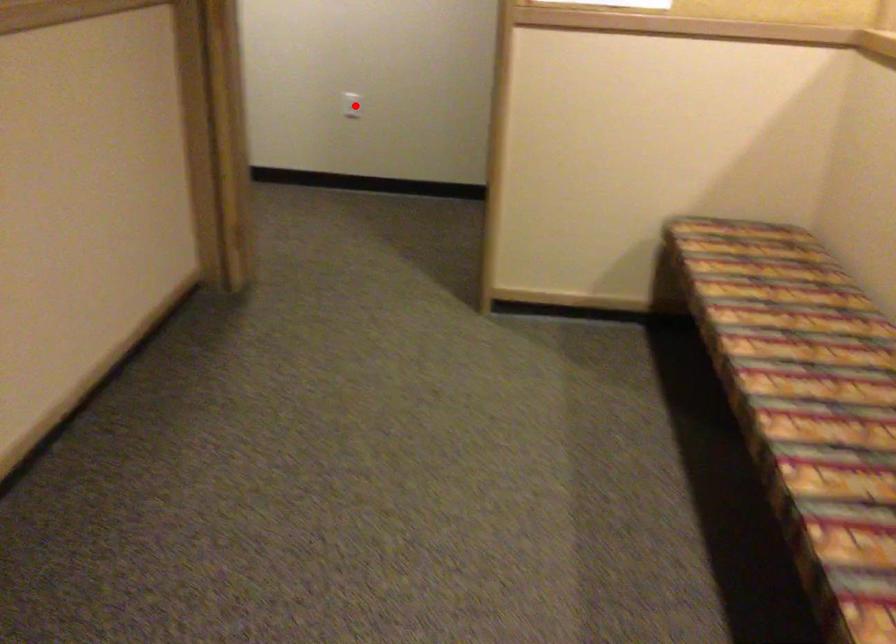
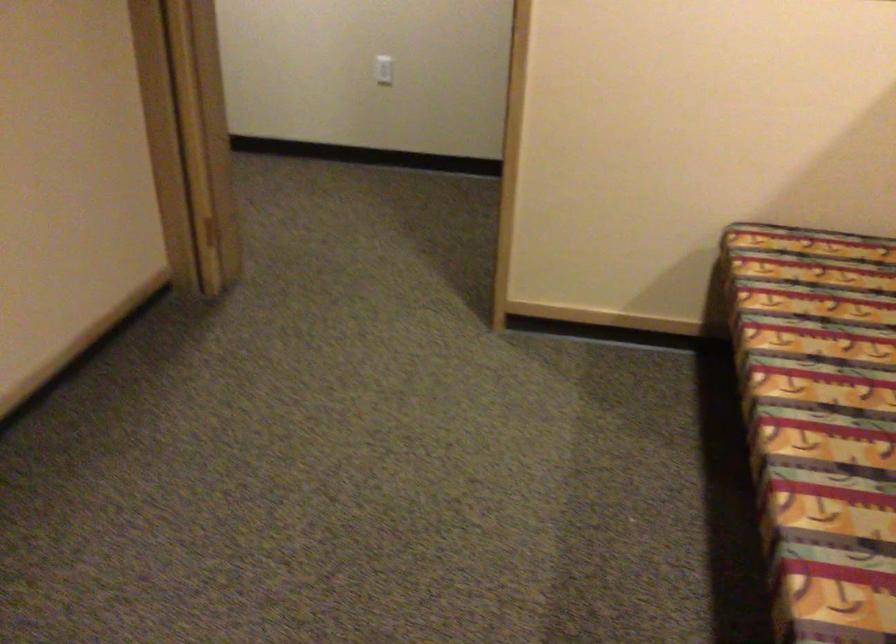
Question: I am providing you with two images of the same scene from different viewpoints. Given a red point in image1, look at the same physical point in image2. Is it:

Choices:
 (A) Closer to the viewpoint
 (B) Farther from the viewpoint

Answer: (A)